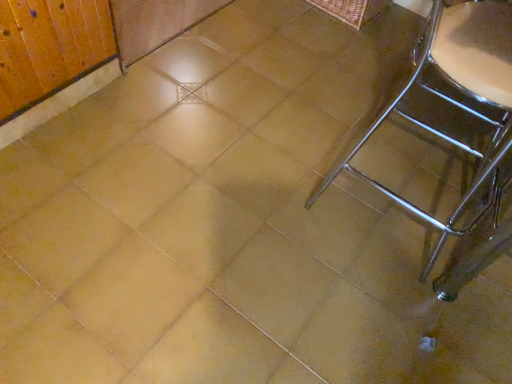
What do you see at coordinates (352, 10) in the screenshot?
I see `woven brown basket at upper right` at bounding box center [352, 10].

Find the location of a particular element. woven brown basket at upper right is located at coordinates tap(352, 10).

Measure the distance between point (362,4) and camera.

The distance of point (362,4) from camera is 7.64 feet.

Measure the distance between point (490, 189) and camera.

The distance of point (490, 189) from camera is 5.67 feet.

The image size is (512, 384). What do you see at coordinates (443, 136) in the screenshot?
I see `polished chrome chair at right` at bounding box center [443, 136].

The width and height of the screenshot is (512, 384). I want to click on polished chrome chair at right, so pos(443,136).

Locate an element on the screen. The width and height of the screenshot is (512, 384). woven brown basket at upper right is located at coordinates (352, 10).

Does polished chrome chair at right appear on the right side of woven brown basket at upper right?

Yes, polished chrome chair at right is to the right of woven brown basket at upper right.

Is polished chrome chair at right behind woven brown basket at upper right?

No, polished chrome chair at right is in front of woven brown basket at upper right.

Is point (493, 112) closer or farther from the camera than point (340, 20)?

Point (493, 112) is positioned closer to the camera compared to point (340, 20).

From the image's perspective, is polished chrome chair at right located above or below woven brown basket at upper right?

polished chrome chair at right is below woven brown basket at upper right.

From a real-world perspective, is polished chrome chair at right over woven brown basket at upper right?

Yes.

Which of these two, polished chrome chair at right or woven brown basket at upper right, is thinner?

woven brown basket at upper right is thinner.

Does polished chrome chair at right have a greater height compared to woven brown basket at upper right?

Yes.

In terms of size, does polished chrome chair at right appear bigger or smaller than woven brown basket at upper right?

Clearly, polished chrome chair at right is larger in size than woven brown basket at upper right.

In the scene shown: Does polished chrome chair at right contain woven brown basket at upper right?

Actually, woven brown basket at upper right is outside polished chrome chair at right.

Is polished chrome chair at right far from woven brown basket at upper right?

No, polished chrome chair at right is in close proximity to woven brown basket at upper right.

Does polished chrome chair at right turn towards woven brown basket at upper right?

No, polished chrome chair at right is not facing towards woven brown basket at upper right.

Can you tell me how much polished chrome chair at right and woven brown basket at upper right differ in facing direction?

polished chrome chair at right and woven brown basket at upper right are facing 93.9 degrees away from each other.

Where is `basket above the polished chrome chair at right (from the image's perspective)`? basket above the polished chrome chair at right (from the image's perspective) is located at coordinates (352, 10).

Which is more to the right, woven brown basket at upper right or polished chrome chair at right?

Positioned to the right is polished chrome chair at right.

Consider the image. Which object is further away from the camera taking this photo, woven brown basket at upper right or polished chrome chair at right?

woven brown basket at upper right is more distant.

Considering the positions of point (380, 9) and point (424, 110), is point (380, 9) closer or farther from the camera than point (424, 110)?

Point (380, 9) appears to be farther away from the viewer than point (424, 110).

From the image's perspective, relative to polished chrome chair at right, is woven brown basket at upper right above or below?

Based on their image positions, woven brown basket at upper right is located above polished chrome chair at right.

From a real-world perspective, is woven brown basket at upper right physically located above or below polished chrome chair at right?

From a real-world perspective, woven brown basket at upper right is physically below polished chrome chair at right.

Considering the sizes of woven brown basket at upper right and polished chrome chair at right in the image, is woven brown basket at upper right wider or thinner than polished chrome chair at right?

Considering their sizes, woven brown basket at upper right looks slimmer than polished chrome chair at right.

Considering the sizes of objects woven brown basket at upper right and polished chrome chair at right in the image provided, who is shorter, woven brown basket at upper right or polished chrome chair at right?

woven brown basket at upper right.

Who is bigger, woven brown basket at upper right or polished chrome chair at right?

With larger size is polished chrome chair at right.

Is woven brown basket at upper right outside of polished chrome chair at right?

woven brown basket at upper right lies outside polished chrome chair at right's area.

Would you consider woven brown basket at upper right to be distant from polished chrome chair at right?

No, woven brown basket at upper right is not far from polished chrome chair at right.

Looking at this image, could you tell me if woven brown basket at upper right is turned towards polished chrome chair at right?

No, woven brown basket at upper right is not facing towards polished chrome chair at right.

Can you tell me how much woven brown basket at upper right and polished chrome chair at right differ in facing direction?

There is a 93.9-degree angle between the facing directions of woven brown basket at upper right and polished chrome chair at right.

Measure the distance between woven brown basket at upper right and polished chrome chair at right.

The distance of woven brown basket at upper right from polished chrome chair at right is 32.02 inches.

You are a GUI agent. You are given a task and a screenshot of the screen. Output one action in this format:
    pyautogui.click(x=<x>, y=<y>)
    Task: Click on the furniture on the right of the woven brown basket at upper right
    This screenshot has height=384, width=512.
    Given the screenshot: What is the action you would take?
    pyautogui.click(x=443, y=136)

Where is `basket below the polished chrome chair at right (from a real-world perspective)`? The width and height of the screenshot is (512, 384). basket below the polished chrome chair at right (from a real-world perspective) is located at coordinates (352, 10).

Where is `basket on the left of polished chrome chair at right`? The width and height of the screenshot is (512, 384). basket on the left of polished chrome chair at right is located at coordinates (352, 10).